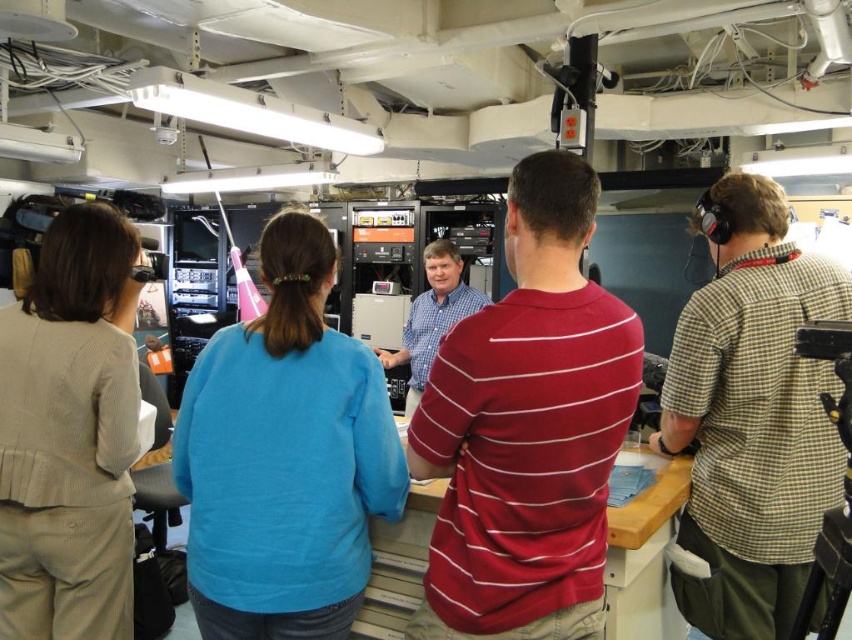
You are standing in the control room and need to set up a camera on the black plastic tripod at right. The person in the blue plaid shirt at center is currently blocking the area where the tripod is placed. Can you move the tripod to another location without disturbing the person?

The black plastic tripod at right is located below the blue plaid shirt at center, so it is positioned under their feet or within their immediate space. Moving it might require the person to step aside or adjust their position, which could disturb them. Consider checking if there is an alternative spot farther away from the person.

You are standing in the control room and see the checkered fabric shirt at right and the black plastic tripod at right. Which one is higher?

The checkered fabric shirt at right is above the black plastic tripod at right, so the checkered fabric shirt at right is higher.